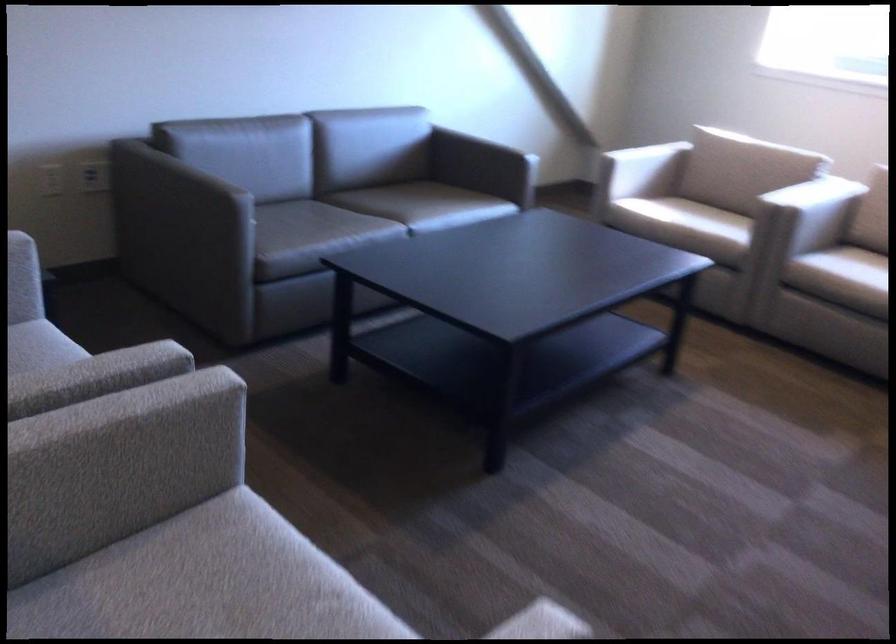
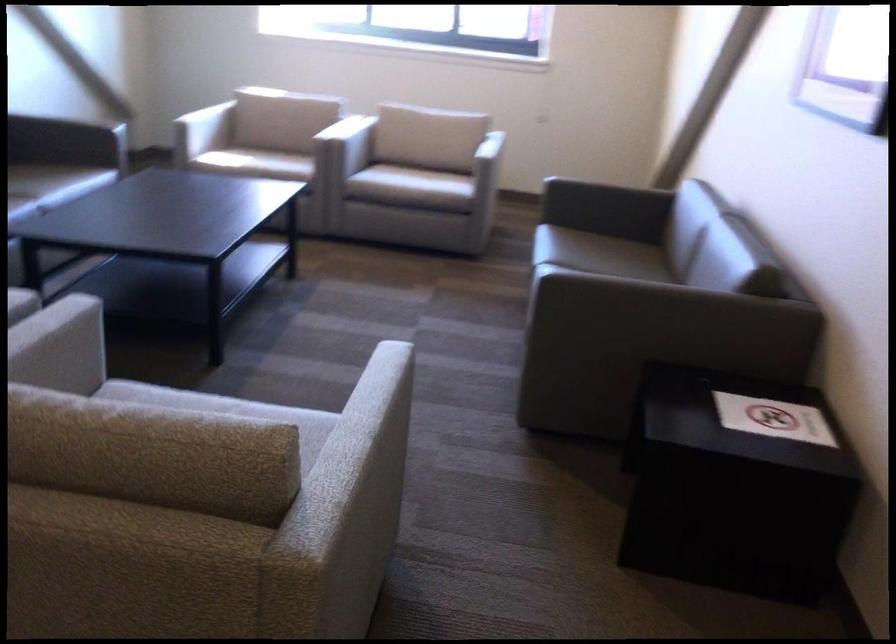
Locate, in the second image, the point that corresponds to pixel 201 456 in the first image.

(58, 368)